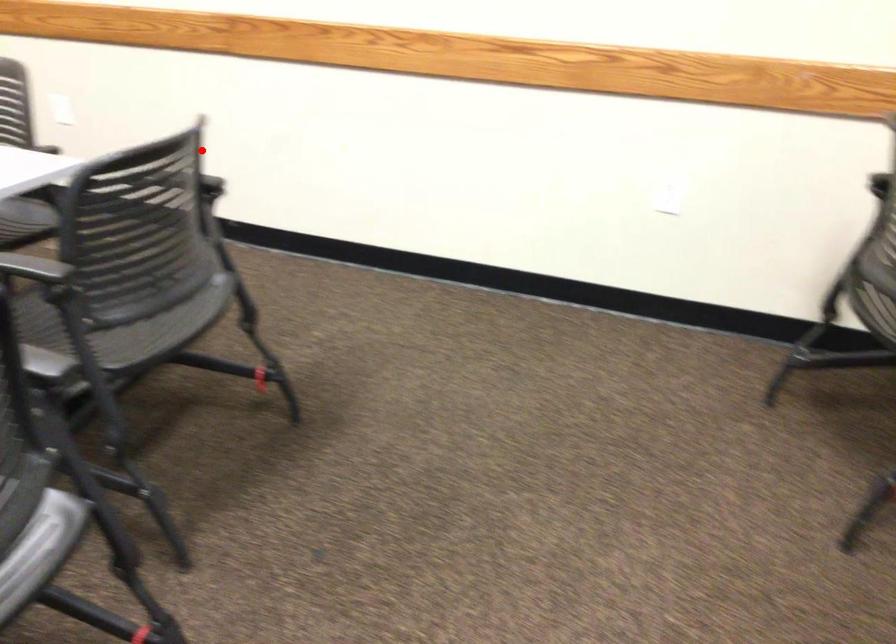
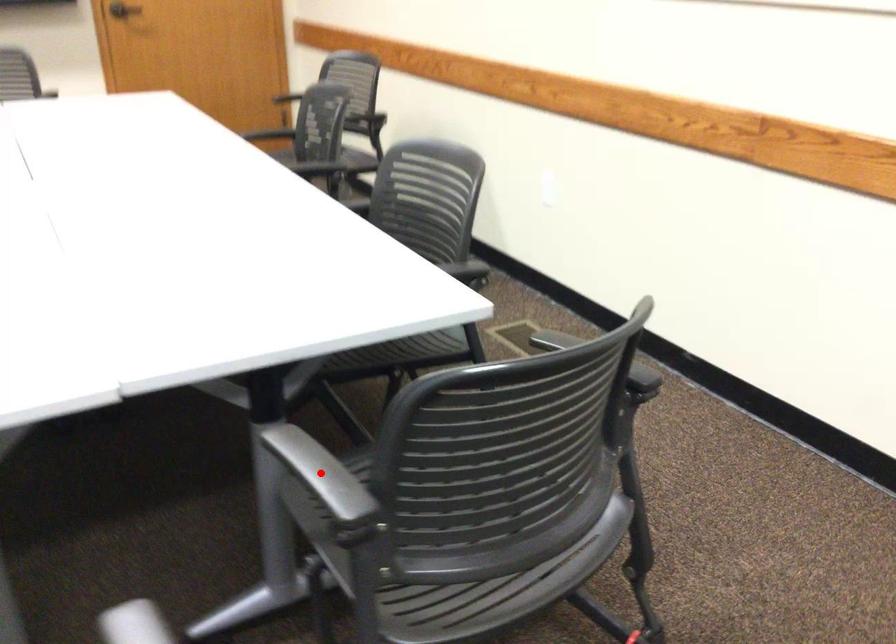
I am providing you with two images of the same scene from different viewpoints. A red point is marked on the first image and another point is marked on the second image. Does the point marked in image1 correspond to the same location as the one in image2?

No